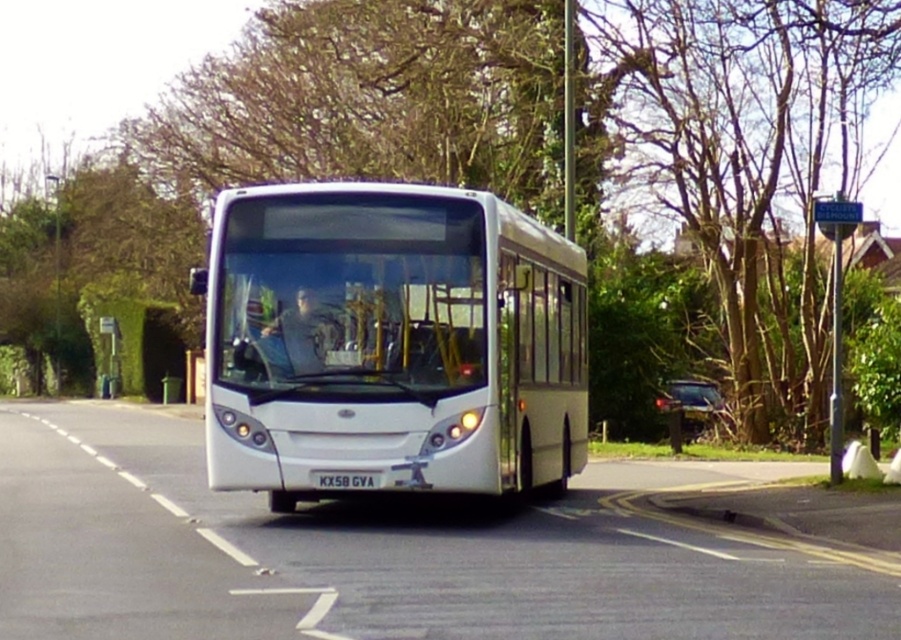
Locate an element on the screen. green leafy tree at center is located at coordinates (722, 193).

Is green leafy tree at center to the right of black plastic license plate at center from the viewer's perspective?

Incorrect, green leafy tree at center is not on the right side of black plastic license plate at center.

Image resolution: width=901 pixels, height=640 pixels. Find the location of `green leafy tree at center`. green leafy tree at center is located at coordinates (722, 193).

Identify the location of green leafy tree at center. This screenshot has height=640, width=901. (722, 193).

Is green leafy tree at center thinner than white metallic bus at center?

No, green leafy tree at center is not thinner than white metallic bus at center.

Does green leafy tree at center appear on the left side of white metallic bus at center?

Yes, green leafy tree at center is to the left of white metallic bus at center.

Is point (258, 72) closer to camera compared to point (526, 481)?

That is False.

Find the location of `green leafy tree at center`. green leafy tree at center is located at coordinates (722, 193).

Who is positioned more to the right, white metallic bus at center or black plastic license plate at center?

black plastic license plate at center is more to the right.

Is white metallic bus at center closer to camera compared to black plastic license plate at center?

No, white metallic bus at center is further to the viewer.

Describe the element at coordinates (390, 340) in the screenshot. I see `white metallic bus at center` at that location.

Find the location of `white metallic bus at center`. white metallic bus at center is located at coordinates (390, 340).